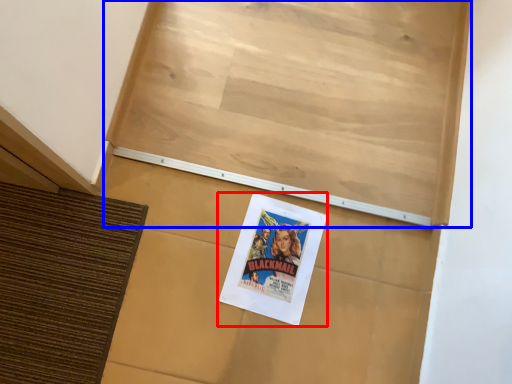
Question: Which point is closer to the camera, poster (highlighted by a red box) or bulletin board (highlighted by a blue box)?

Choices:
 (A) poster
 (B) bulletin board

Answer: (B)